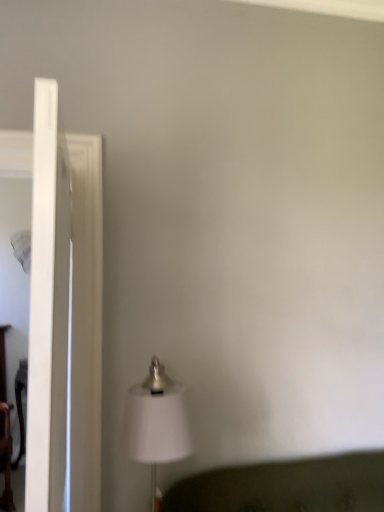
Question: Should I look upward or downward to see clear glass door at left?

Choices:
 (A) up
 (B) down

Answer: (B)

Question: Is white fabric lampshade at lower center a part of clear glass door at left?

Choices:
 (A) yes
 (B) no

Answer: (B)

Question: Is clear glass door at left in contact with white fabric lampshade at lower center?

Choices:
 (A) yes
 (B) no

Answer: (B)

Question: From the image's perspective, is clear glass door at left on top of white fabric lampshade at lower center?

Choices:
 (A) yes
 (B) no

Answer: (A)

Question: Considering the relative sizes of clear glass door at left and white fabric lampshade at lower center in the image provided, is clear glass door at left thinner than white fabric lampshade at lower center?

Choices:
 (A) no
 (B) yes

Answer: (B)

Question: Is clear glass door at left positioned beyond the bounds of white fabric lampshade at lower center?

Choices:
 (A) no
 (B) yes

Answer: (B)

Question: From a real-world perspective, is clear glass door at left beneath white fabric lampshade at lower center?

Choices:
 (A) no
 (B) yes

Answer: (A)

Question: Does white fabric lampshade at lower center appear on the left side of clear glass door at left?

Choices:
 (A) yes
 (B) no

Answer: (B)

Question: Would you say white fabric lampshade at lower center is a long distance from clear glass door at left?

Choices:
 (A) yes
 (B) no

Answer: (B)

Question: Is white fabric lampshade at lower center in contact with clear glass door at left?

Choices:
 (A) no
 (B) yes

Answer: (A)

Question: Considering the relative sizes of white fabric lampshade at lower center and clear glass door at left in the image provided, is white fabric lampshade at lower center taller than clear glass door at left?

Choices:
 (A) no
 (B) yes

Answer: (A)

Question: From a real-world perspective, is white fabric lampshade at lower center positioned over clear glass door at left based on gravity?

Choices:
 (A) no
 (B) yes

Answer: (A)

Question: Is clear glass door at left surrounded by white fabric lampshade at lower center?

Choices:
 (A) no
 (B) yes

Answer: (A)

Question: Looking at the image, does white fabric lampshade at lower center seem bigger or smaller compared to clear glass door at left?

Choices:
 (A) small
 (B) big

Answer: (A)